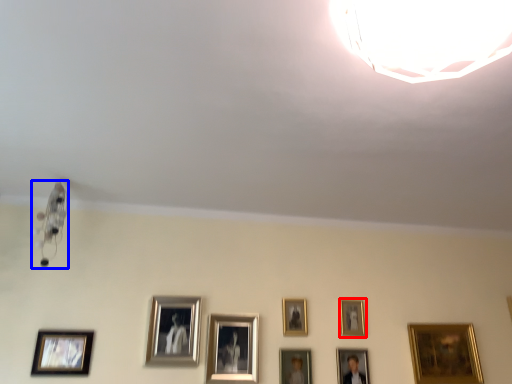
Question: Among these objects, which one is farthest to the camera, picture frame (highlighted by a red box) or lamp (highlighted by a blue box)?

Choices:
 (A) picture frame
 (B) lamp

Answer: (A)